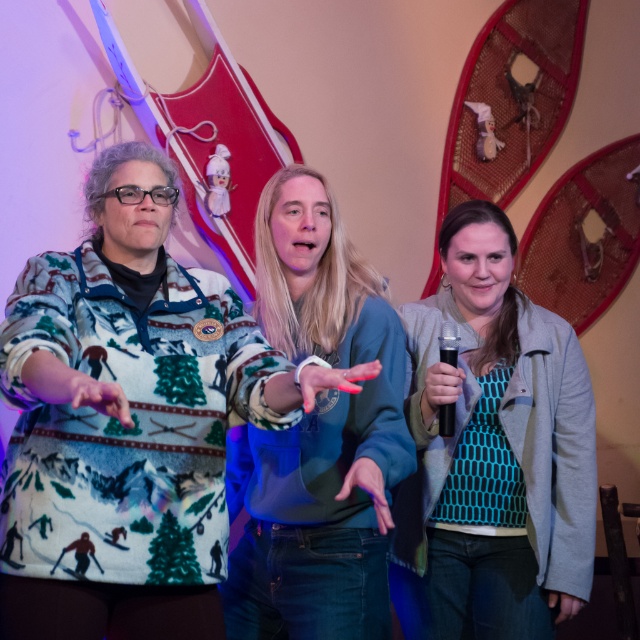
Between point (452, 372) and point (384, 611), which one is positioned behind?

Point (452, 372)

This screenshot has height=640, width=640. I want to click on teal dotted sweater at center, so click(492, 452).